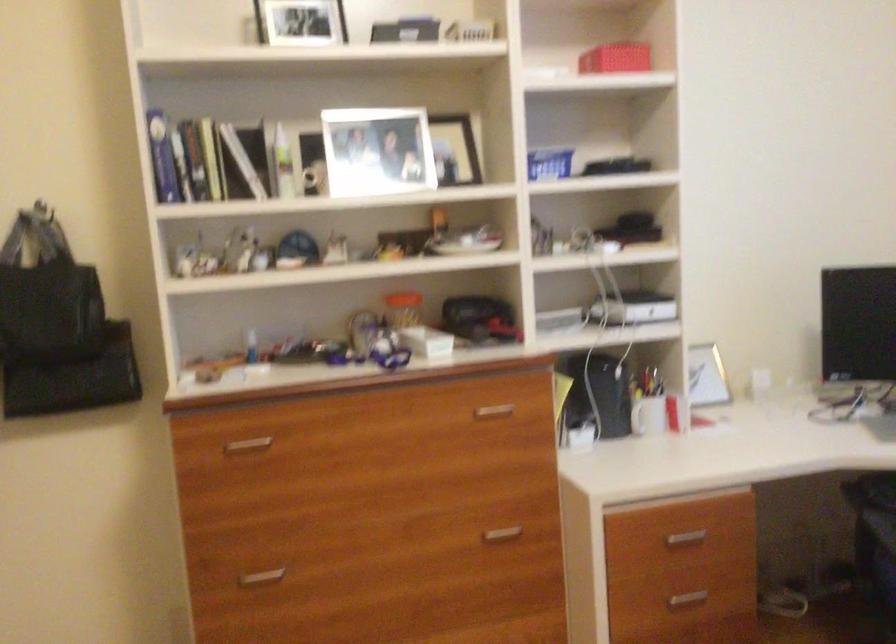
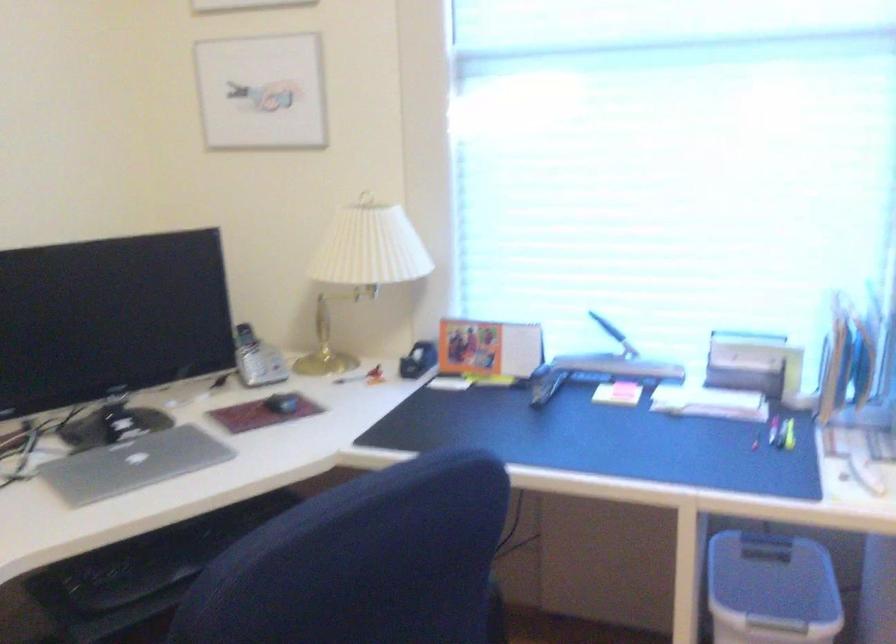
Question: The camera is either moving clockwise (left) or counter-clockwise (right) around the object. The first image is from the beginning of the video and the second image is from the end. Is the camera moving left or right when shooting the video?

Choices:
 (A) Left
 (B) Right

Answer: (A)